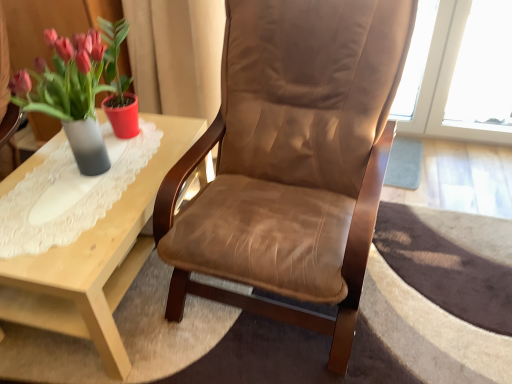
Question: From a real-world perspective, is brown leather chair at center above or below light wood coffee table at left?

Choices:
 (A) below
 (B) above

Answer: (B)

Question: In terms of width, does brown leather chair at center look wider or thinner when compared to light wood coffee table at left?

Choices:
 (A) wide
 (B) thin

Answer: (B)

Question: Which object is positioned closest to the brown leather chair at center?

Choices:
 (A) matte gray vase at left
 (B) light wood coffee table at left

Answer: (B)

Question: Which object is positioned farthest from the light wood coffee table at left?

Choices:
 (A) matte gray vase at left
 (B) brown leather chair at center

Answer: (A)